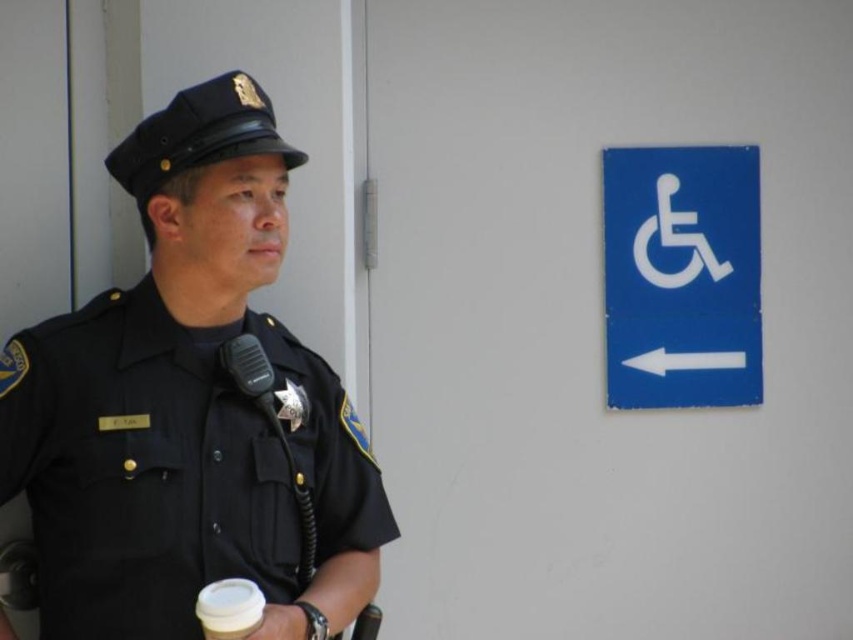
In the scene shown: Can you confirm if blue metal sign at upper right is positioned below white paper cup at lower center?

Incorrect, blue metal sign at upper right is not positioned below white paper cup at lower center.

Can you confirm if blue metal sign at upper right is taller than white paper cup at lower center?

Yes, blue metal sign at upper right is taller than white paper cup at lower center.

Is point (709, 200) less distant than point (202, 625)?

No, (709, 200) is behind (202, 625).

Locate an element on the screen. Image resolution: width=853 pixels, height=640 pixels. blue metal sign at upper right is located at coordinates (x=682, y=276).

Is point (218, 433) farther from viewer compared to point (610, 300)?

No, it is not.

Who is more distant from viewer, (160,184) or (759,388)?

The point (759,388) is behind.

You are a GUI agent. You are given a task and a screenshot of the screen. Output one action in this format:
    pyautogui.click(x=<x>, y=<y>)
    Task: Click on the black uniform at left
    This screenshot has height=640, width=853.
    Given the screenshot: What is the action you would take?
    pyautogui.click(x=189, y=406)

Can you confirm if black uniform at left is positioned to the left of white paper cup at lower center?

Indeed, black uniform at left is positioned on the left side of white paper cup at lower center.

Locate an element on the screen. The width and height of the screenshot is (853, 640). black uniform at left is located at coordinates pyautogui.click(x=189, y=406).

I want to click on black uniform at left, so click(189, 406).